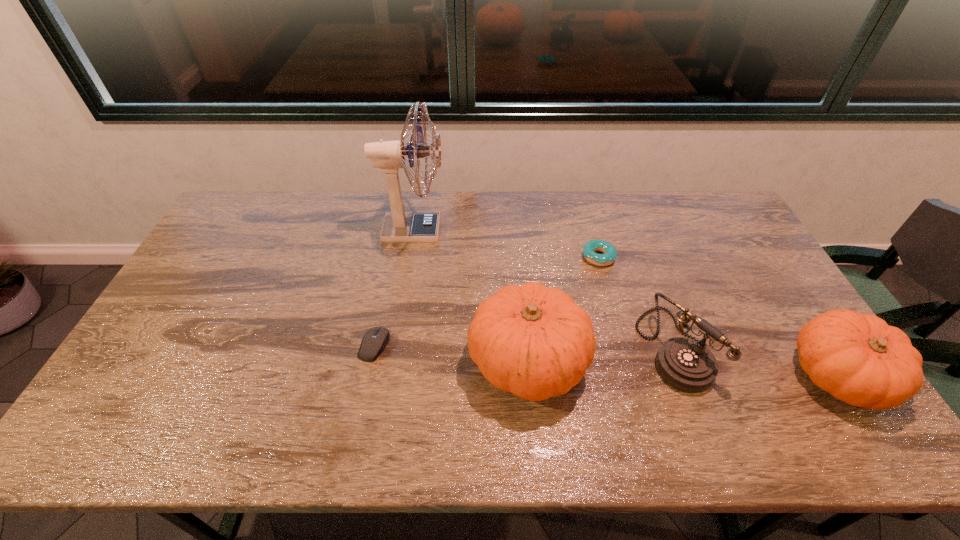
The image size is (960, 540). What are the coordinates of `vacant space located on the front of the doughnut` in the screenshot? It's located at 629,369.

Locate an element on the screen. This screenshot has width=960, height=540. free space located on the front-facing side of the tallest object is located at coordinates (558, 230).

Where is `vacant region located on the back of the telephone`? This screenshot has width=960, height=540. vacant region located on the back of the telephone is located at coordinates (644, 267).

The image size is (960, 540). I want to click on vacant space located 0.080m on the back of the computer equipment, so click(x=382, y=307).

What are the coordinates of `object that is positioned at the far edge` in the screenshot? It's located at (399, 227).

Find the location of a particular element. The height and width of the screenshot is (540, 960). telephone that is at the near edge is located at coordinates (687, 365).

The width and height of the screenshot is (960, 540). In order to click on object positioned at the right edge in this screenshot , I will do `click(859, 359)`.

I want to click on object that is at the near right corner, so click(859, 359).

In the image, there is a desktop. Where is `vacant area at the far edge`? vacant area at the far edge is located at coordinates (454, 192).

Where is `free space at the near edge of the desktop`? This screenshot has width=960, height=540. free space at the near edge of the desktop is located at coordinates (709, 394).